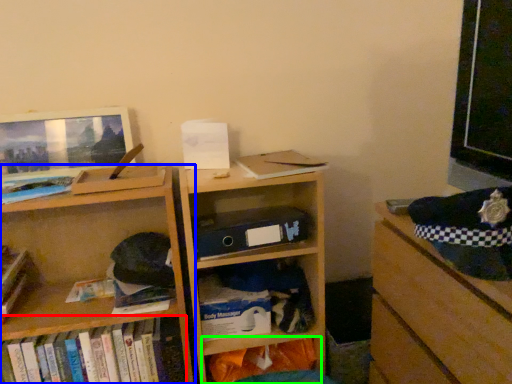
Question: Which is farther away from book (highlighted by a red box)? shelf (highlighted by a blue box) or shelf (highlighted by a green box)?

Choices:
 (A) shelf
 (B) shelf

Answer: (B)